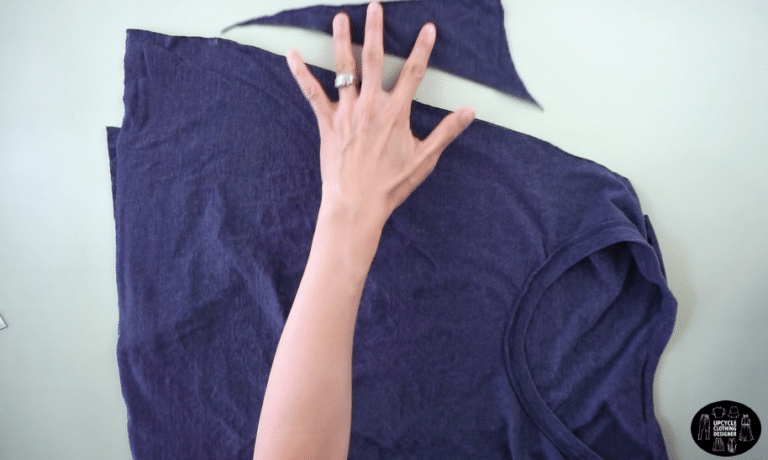
Where is `visible section of a grey table that the dark-blue t-shirt is placed on`? visible section of a grey table that the dark-blue t-shirt is placed on is located at coordinates (646, 83), (12, 200).